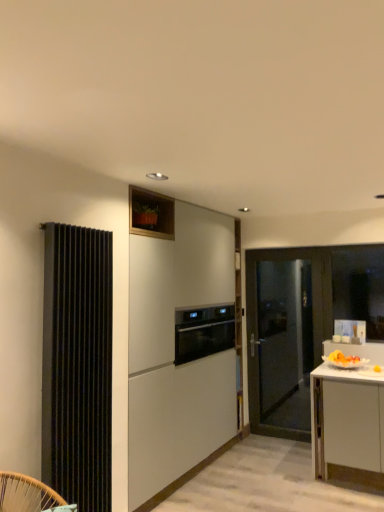
Measure the distance between matte black door at right and camera.

They are 4.43 meters apart.

In order to face matte black door at right, should I rotate leftwards or rightwards?

You should rotate right by 12.381 degrees.

You are a GUI agent. You are given a task and a screenshot of the screen. Output one action in this format:
    pyautogui.click(x=<x>, y=<y>)
    Task: Click on the white matte cabinet at center
    
    Given the screenshot: What is the action you would take?
    pyautogui.click(x=179, y=345)

This screenshot has height=512, width=384. Find the location of `matte black door at right`. matte black door at right is located at coordinates (285, 335).

Considering the sizes of objects white matte cabinet at center and transparent glass window at right in the image provided, who is taller, white matte cabinet at center or transparent glass window at right?

With more height is white matte cabinet at center.

From a real-world perspective, between white matte cabinet at center and transparent glass window at right, who is vertically lower?

white matte cabinet at center.

Is white matte cabinet at center far from transparent glass window at right?

Yes, white matte cabinet at center and transparent glass window at right are quite far apart.

Considering the relative positions of black ribbed radiator at left and transparent glass window at right in the image provided, is black ribbed radiator at left behind transparent glass window at right?

No, black ribbed radiator at left is closer to the camera.

Based on the photo, is black ribbed radiator at left oriented away from transparent glass window at right?

black ribbed radiator at left does not have its back to transparent glass window at right.

Are black ribbed radiator at left and transparent glass window at right located far from each other?

Absolutely, black ribbed radiator at left is distant from transparent glass window at right.

Looking at the image, does black ribbed radiator at left seem bigger or smaller compared to transparent glass window at right?

Clearly, black ribbed radiator at left is larger in size than transparent glass window at right.

Consider the image. Is white matte cabinet at center at the back of satin black oven at center?

Yes, white matte cabinet at center is at the back of satin black oven at center.

Are satin black oven at center and white matte cabinet at center beside each other?

satin black oven at center and white matte cabinet at center are not in contact.

Does point (210, 349) come closer to viewer compared to point (191, 260)?

No, (210, 349) is behind (191, 260).

Is satin black oven at center outside of white matte cabinet at center?

No, satin black oven at center is not outside of white matte cabinet at center.

Which is correct: black ribbed radiator at left is inside matte black door at right, or outside of it?

black ribbed radiator at left is outside matte black door at right.

Which of these two, black ribbed radiator at left or matte black door at right, is bigger?

With larger size is matte black door at right.

The image size is (384, 512). In the image, there is a black ribbed radiator at left. Find the location of `door below it (from the image's perspective)`. door below it (from the image's perspective) is located at coordinates (285, 335).

Consider the image. How different are the orientations of white matte cabinet at center and matte black door at right in degrees?

90.2 degrees.

In the scene shown: Is white matte cabinet at center next to matte black door at right?

white matte cabinet at center and matte black door at right are not in contact.

Between white matte cabinet at center and matte black door at right, which one appears on the left side from the viewer's perspective?

white matte cabinet at center.

Can you confirm if white matte cabinet at center is taller than matte black door at right?

Yes, white matte cabinet at center is taller than matte black door at right.

From the image's perspective, between matte black door at right and satin black oven at center, who is located below?

matte black door at right.

Based on the photo, which is more to the right, matte black door at right or satin black oven at center?

matte black door at right.

From a real-world perspective, is matte black door at right physically below satin black oven at center?

Yes, from a real-world perspective, matte black door at right is below satin black oven at center.

Does matte black door at right have a lesser height compared to satin black oven at center?

No.

Who is smaller, white matte cabinet at center or black ribbed radiator at left?

black ribbed radiator at left.

Who is shorter, white matte cabinet at center or black ribbed radiator at left?

black ribbed radiator at left.

Does white matte cabinet at center turn towards black ribbed radiator at left?

No, white matte cabinet at center is not facing towards black ribbed radiator at left.

How many degrees apart are the facing directions of white matte cabinet at center and black ribbed radiator at left?

The angular difference between white matte cabinet at center and black ribbed radiator at left is 0.389 degrees.

Where is `window screen behind the white matte cabinet at center`? The height and width of the screenshot is (512, 384). window screen behind the white matte cabinet at center is located at coordinates (359, 286).

Find the location of `window screen above the black ribbed radiator at left (from the image's perspective)`. window screen above the black ribbed radiator at left (from the image's perspective) is located at coordinates (359, 286).

From the image, which object appears to be nearer to black ribbed radiator at left, satin black oven at center or matte black door at right?

Among the two, satin black oven at center is located nearer to black ribbed radiator at left.

Considering their positions, is matte black door at right positioned further to black ribbed radiator at left than satin black oven at center?

The object further to black ribbed radiator at left is matte black door at right.

From the image, which object appears to be farther from transparent glass window at right, satin black oven at center or black ribbed radiator at left?

Among the two, black ribbed radiator at left is located further to transparent glass window at right.

Based on their spatial positions, is transparent glass window at right or white matte cabinet at center closer to matte black door at right?

transparent glass window at right.

When comparing their distances from matte black door at right, does black ribbed radiator at left or satin black oven at center seem further?

black ribbed radiator at left is further to matte black door at right.

Based on their spatial positions, is transparent glass window at right or white matte cabinet at center closer to satin black oven at center?

white matte cabinet at center is closer to satin black oven at center.

Which object lies nearer to the anchor point black ribbed radiator at left, transparent glass window at right or white matte cabinet at center?

Result: white matte cabinet at center is closer to black ribbed radiator at left.

From the image, which object appears to be farther from matte black door at right, white matte cabinet at center or black ribbed radiator at left?

black ribbed radiator at left.

The height and width of the screenshot is (512, 384). Find the location of `cabinetry between black ribbed radiator at left and matte black door at right along the z-axis`. cabinetry between black ribbed radiator at left and matte black door at right along the z-axis is located at coordinates (x=179, y=345).

At what (x,y) coordinates should I click in order to perform the action: click on door between white matte cabinet at center and transparent glass window at right from left to right. Please return your answer as a coordinate pair (x, y). The width and height of the screenshot is (384, 512). Looking at the image, I should click on [x=285, y=335].

Where is `kitchen appliance between white matte cabinet at center and matte black door at right in the front-back direction`? The image size is (384, 512). kitchen appliance between white matte cabinet at center and matte black door at right in the front-back direction is located at coordinates (203, 332).

Find the location of `window screen located between black ribbed radiator at left and matte black door at right in the depth direction`. window screen located between black ribbed radiator at left and matte black door at right in the depth direction is located at coordinates (359, 286).